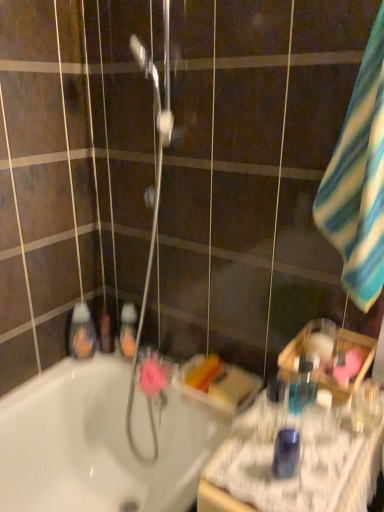
Locate an element on the screen. vacant region to the left of blue plastic mouthwash at right, which is the 6th mouthwash from back to front is located at coordinates (233, 448).